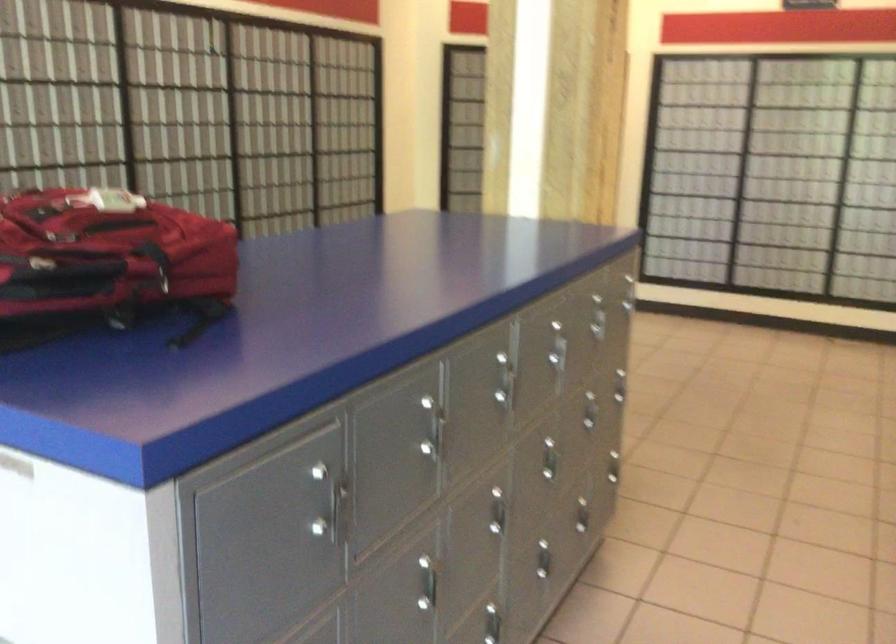
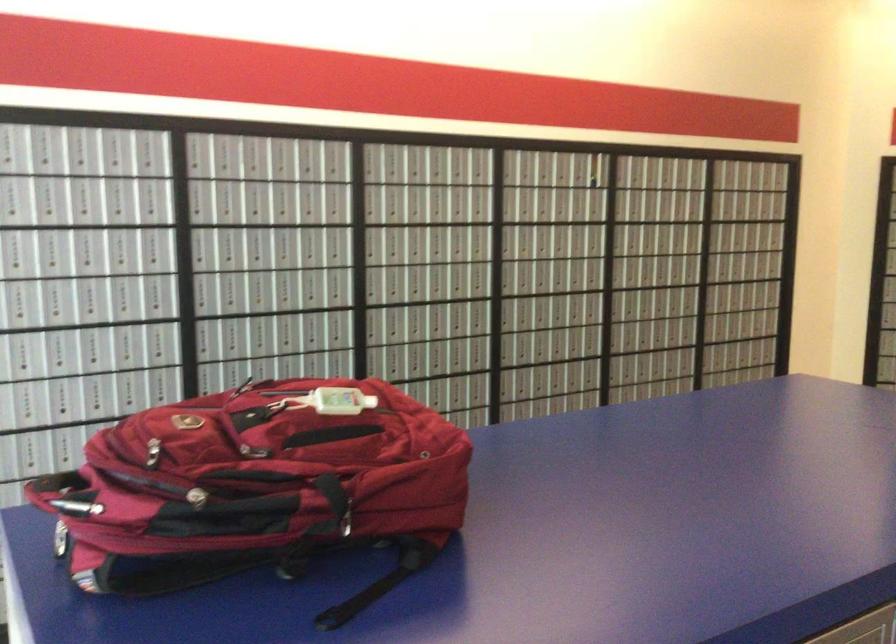
Question: The camera is either moving clockwise (left) or counter-clockwise (right) around the object. The first image is from the beginning of the video and the second image is from the end. Is the camera moving left or right when shooting the video?

Choices:
 (A) Left
 (B) Right

Answer: (B)